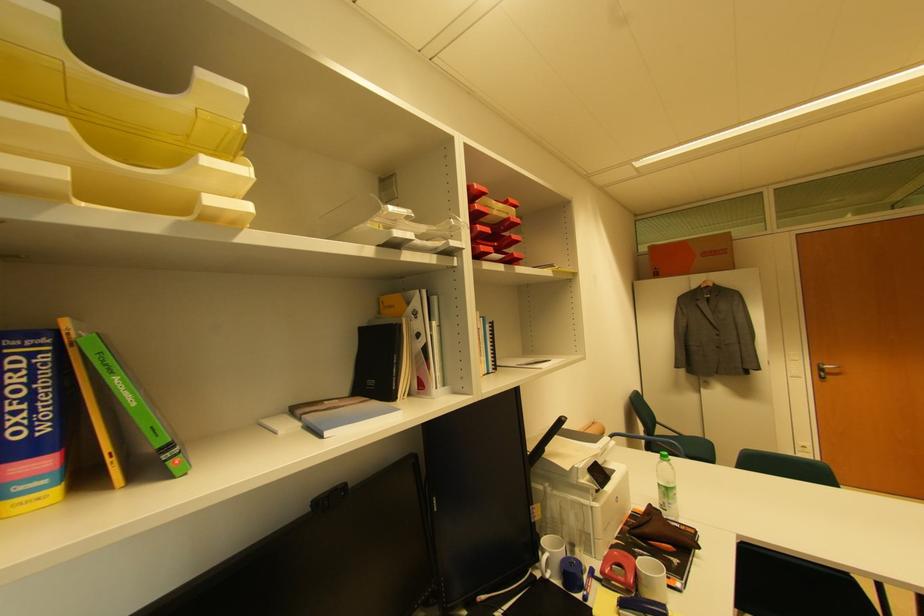
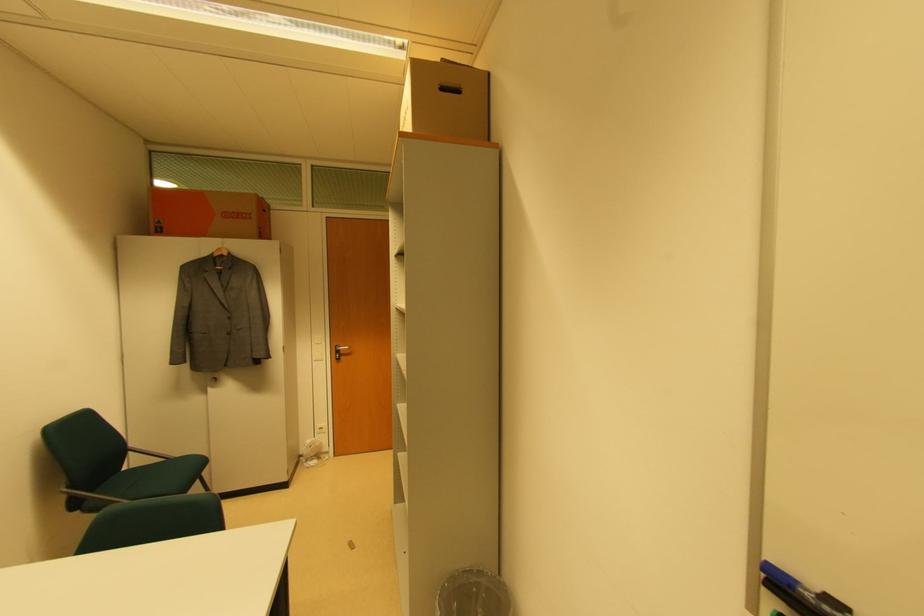
Locate, in the second image, the point that corresponds to [820,367] in the first image.

(337, 349)